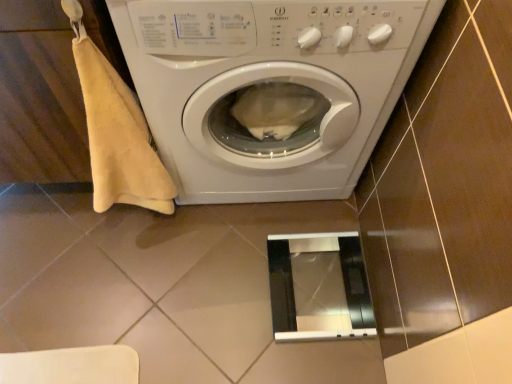
Find the location of a particular element. This screenshot has width=512, height=384. vacant area on top of metallic silver screen door at lower center (from a real-world perspective) is located at coordinates (318, 284).